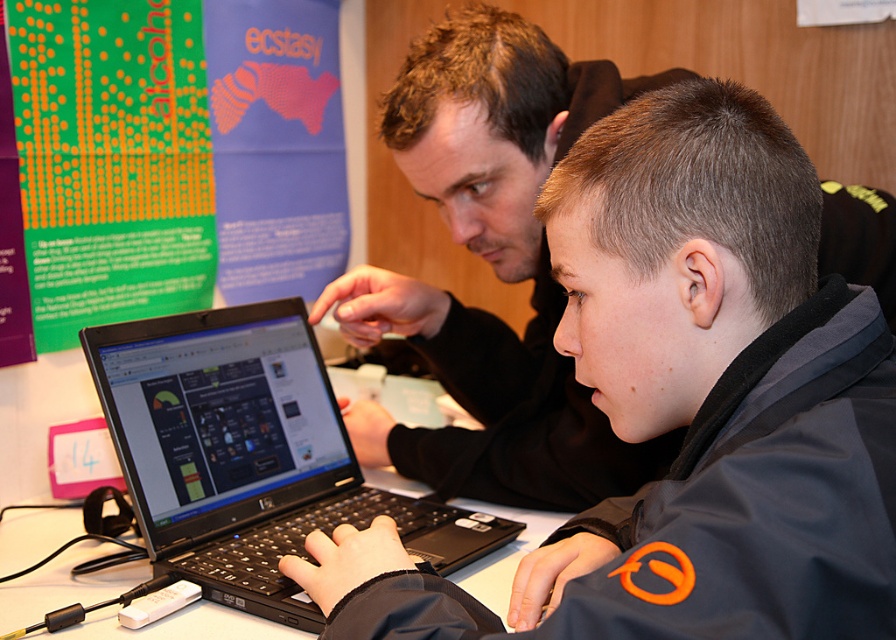
Is point (481, 99) closer to camera compared to point (237, 499)?

No, it is not.

Is black matte laptop at left to the right of black plastic laptop at center from the viewer's perspective?

Indeed, black matte laptop at left is positioned on the right side of black plastic laptop at center.

Between point (437, 353) and point (145, 392), which one is positioned behind?

Point (437, 353)

Where is `black matte laptop at left`? This screenshot has width=896, height=640. black matte laptop at left is located at coordinates (493, 269).

Does green paper at upper left come in front of black matte laptop at left?

No, green paper at upper left is behind black matte laptop at left.

Between point (63, 93) and point (401, 433), which one is positioned in front?

Point (63, 93) is in front.

Image resolution: width=896 pixels, height=640 pixels. I want to click on green paper at upper left, so click(x=174, y=154).

Is point (514, 364) positioned behind point (216, 616)?

Yes, point (514, 364) is farther from viewer.

I want to click on black matte laptop at left, so click(493, 269).